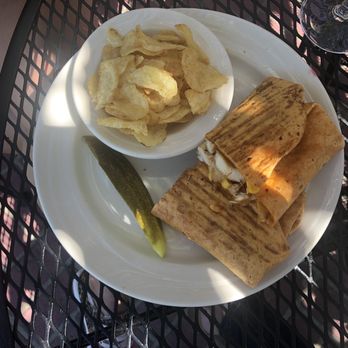
Locate an element on the screen. This screenshot has height=348, width=348. white plate is located at coordinates (172, 298).